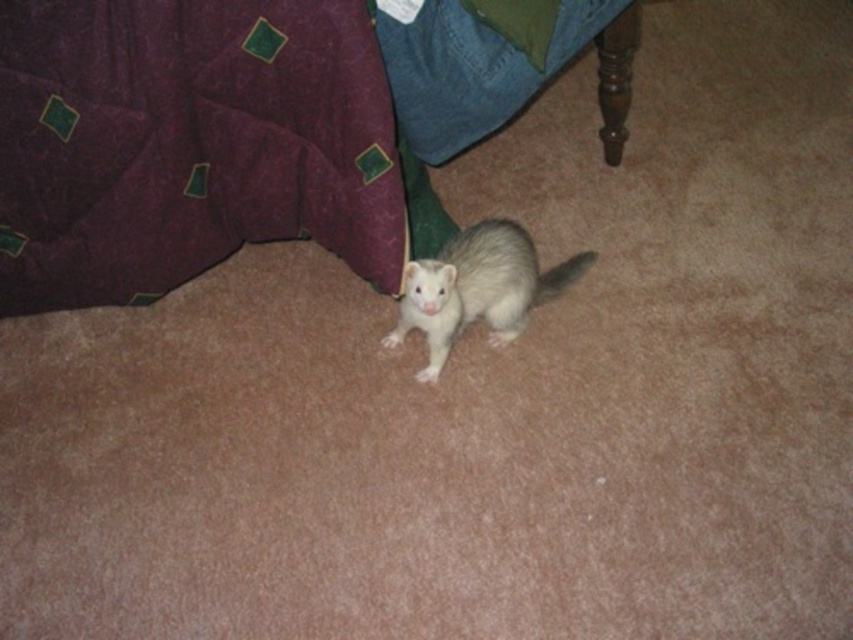
Can you confirm if white fur ferret at center is positioned to the right of white fur tail at center?

In fact, white fur ferret at center is to the left of white fur tail at center.

Based on the photo, between white fur ferret at center and white fur tail at center, which one appears on the right side from the viewer's perspective?

white fur tail at center

Is point (428, 371) positioned in front of point (570, 273)?

Yes, it is.

This screenshot has width=853, height=640. Find the location of `white fur ferret at center`. white fur ferret at center is located at coordinates (477, 288).